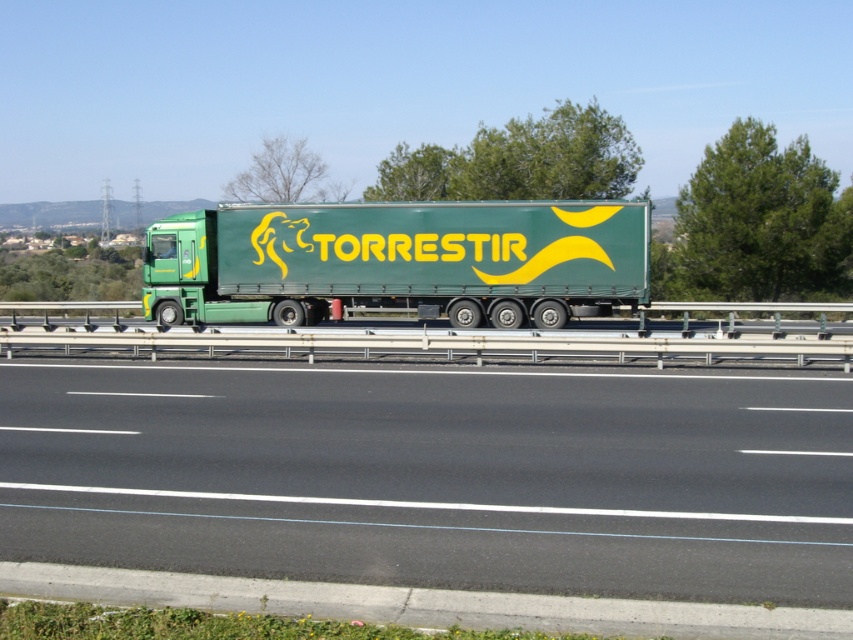
You are a drone operator flying a drone that is 1.2 meters wide. You want to fly the drone between the black asphalt highway at center and the camera. Is there enough space for the drone to pass through?

The distance between the black asphalt highway at center and the camera is 5.40 meters. Since the drone is 1.2 meters wide, there is sufficient space for it to pass through as 5.40 meters is greater than 1.2 meters.

You are a driver who needs to make a sudden stop on the highway. You see the black asphalt highway at center located at point (436,476). Is there enough space to stop safely?

The black asphalt highway at center is located at point (436,476). Since the highway is described as having no other vehicles visible in the immediate vicinity and the road surface is clear, there is likely enough space to stop safely.

You are a driver who needs to park the green matte trailer truck at center on the black asphalt highway at center. Is the truck currently positioned above the highway where it can safely park?

The black asphalt highway at center is below green matte trailer truck at center, so the truck is already positioned above the highway and can safely park there.